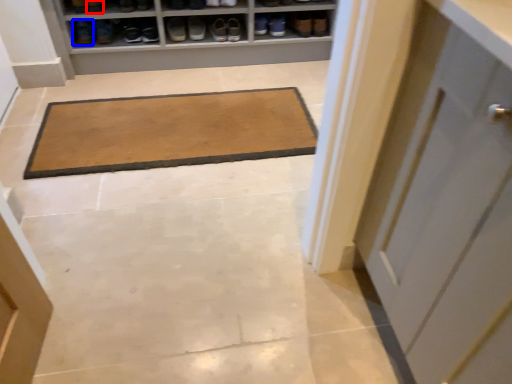
Question: Which object is further to the camera taking this photo, shoe (highlighted by a red box) or footwear (highlighted by a blue box)?

Choices:
 (A) shoe
 (B) footwear

Answer: (B)